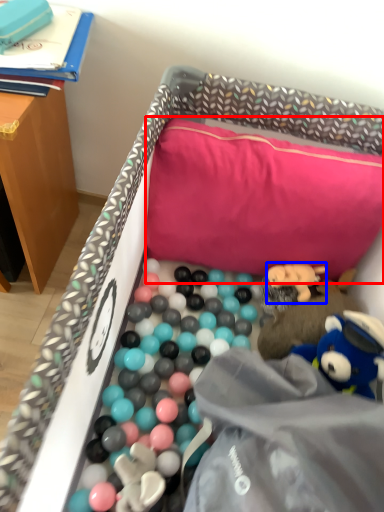
Question: Which point is closer to the camera, pillow (highlighted by a red box) or toy (highlighted by a blue box)?

Choices:
 (A) pillow
 (B) toy

Answer: (A)